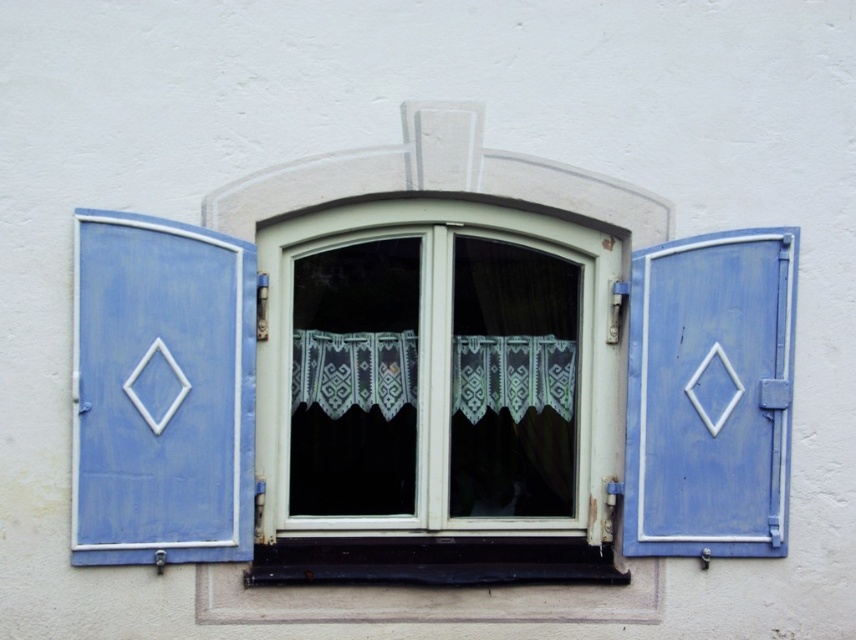
Question: Is matte blue wooden shutter at left further to camera compared to blue matte shutter at right?

Choices:
 (A) yes
 (B) no

Answer: (B)

Question: Does matte blue wooden shutter at left come behind black painted wood at lower center?

Choices:
 (A) no
 (B) yes

Answer: (A)

Question: Which of the following is the farthest from the observer?

Choices:
 (A) blue matte shutter at right
 (B) matte blue wooden shutter at left
 (C) black painted wood at lower center

Answer: (A)

Question: Does matte blue wooden shutter at left lie behind black painted wood at lower center?

Choices:
 (A) no
 (B) yes

Answer: (A)

Question: Which of the following is the closest to the observer?

Choices:
 (A) (414, 540)
 (B) (767, 250)

Answer: (B)

Question: Which point is closer to the camera?

Choices:
 (A) (244, 266)
 (B) (563, 550)
 (C) (646, 321)

Answer: (A)